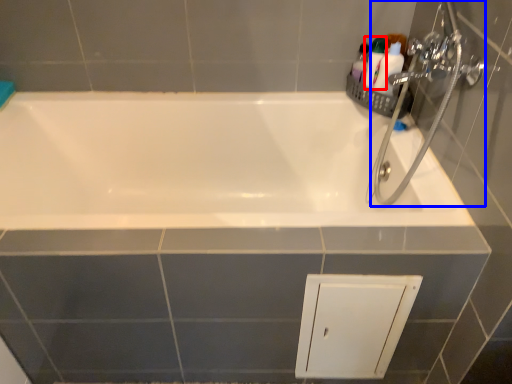
Question: Which point is further to the camera, toiletry (highlighted by a red box) or plumbing fixture (highlighted by a blue box)?

Choices:
 (A) toiletry
 (B) plumbing fixture

Answer: (A)